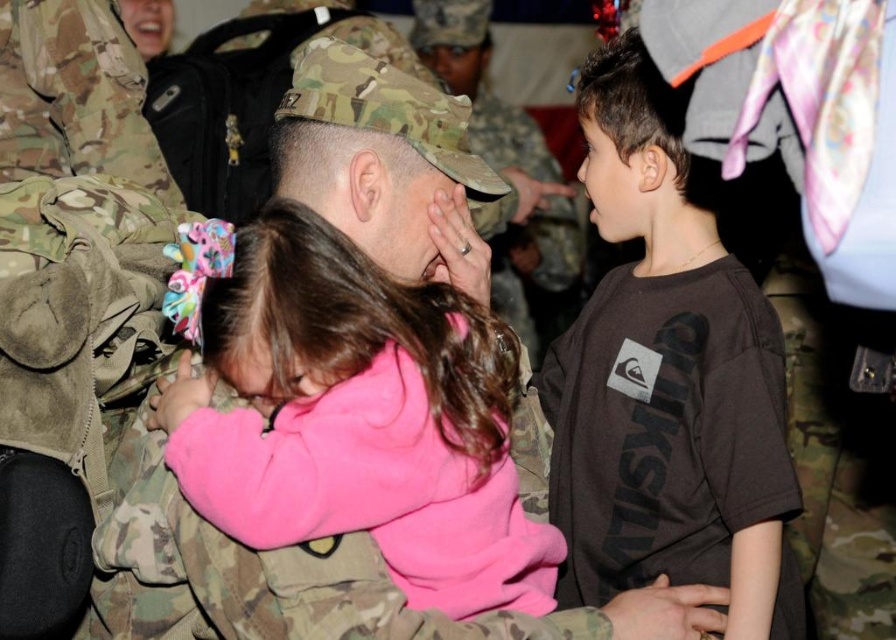
Question: Is dark brown cotton t-shirt at right behind matte camouflage forehead at center?

Choices:
 (A) yes
 (B) no

Answer: (B)

Question: In this image, where is matte camouflage uniform at center located relative to matte camouflage forehead at center?

Choices:
 (A) right
 (B) left

Answer: (A)

Question: Which object appears farthest from the camera in this image?

Choices:
 (A) dark brown cotton t-shirt at right
 (B) matte camouflage uniform at center
 (C) matte camouflage forehead at center

Answer: (B)

Question: Which object is the farthest from the matte camouflage uniform at center?

Choices:
 (A) matte camouflage forehead at center
 (B) dark brown cotton t-shirt at right

Answer: (A)

Question: From the image, what is the correct spatial relationship of pink fleece at center in relation to dark brown cotton t-shirt at right?

Choices:
 (A) below
 (B) above

Answer: (A)

Question: Which of the following is the farthest from the observer?

Choices:
 (A) (495, 305)
 (B) (316, 196)
 (C) (409, 353)
 (D) (602, 365)

Answer: (A)